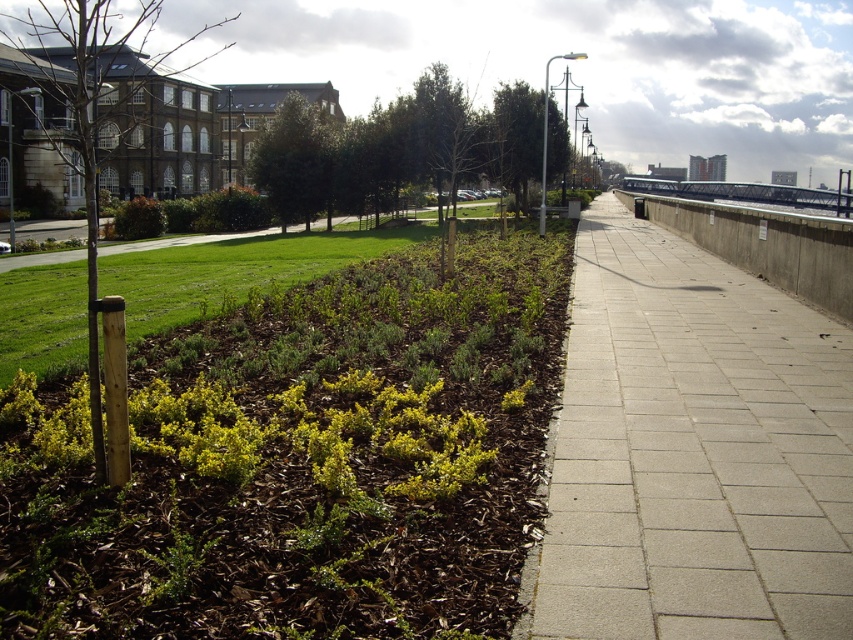
You are standing at the point marked by the coordinates point [300,460] in the park scene. What is the nearest object to you?

The nearest object to you is the green mulch at lower left, as the coordinates point [300,460] indicates its location.